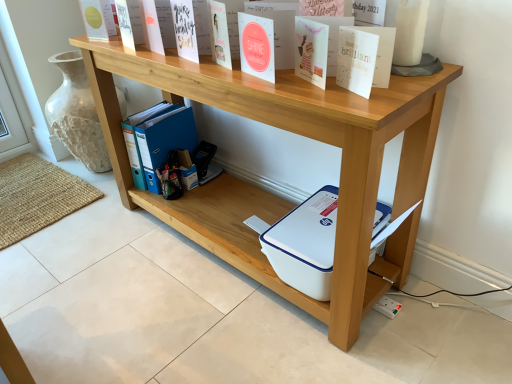
Identify the location of vacant area situated to the left side of natural wood shelf at upper center, placed as the 2th shelf when sorted from bottom to top. This screenshot has width=512, height=384. (113, 271).